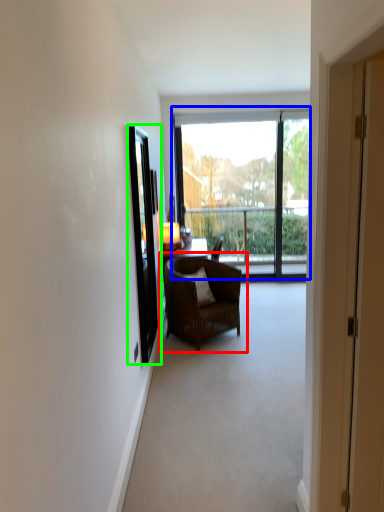
Question: Which object is positioned closest to chair (highlighted by a red box)? Select from window (highlighted by a blue box) and screen door (highlighted by a green box).

Choices:
 (A) window
 (B) screen door

Answer: (B)